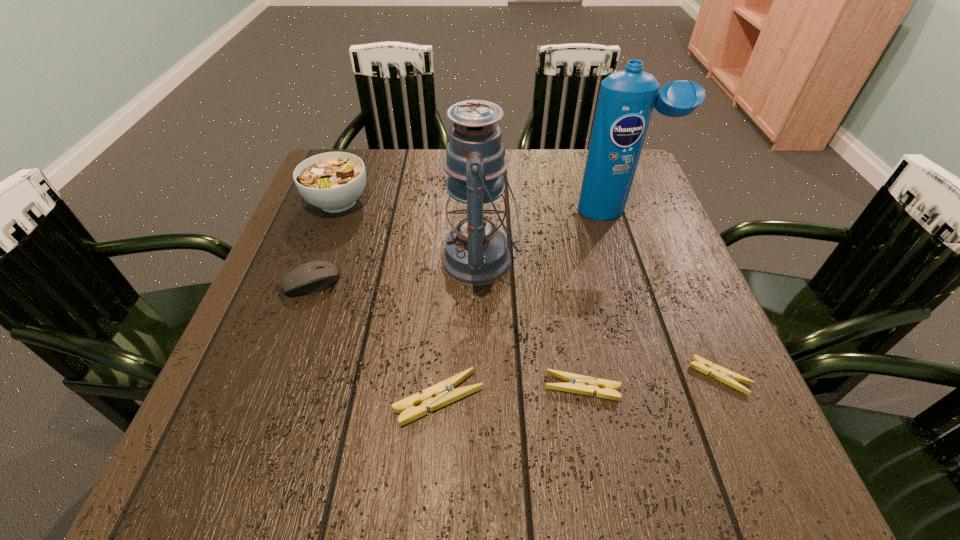
Where is `vacant area at the near right corner of the desktop`? This screenshot has width=960, height=540. vacant area at the near right corner of the desktop is located at coordinates (708, 419).

What are the coordinates of `empty space between the leftmost clothespin and the second shortest object` in the screenshot? It's located at (511, 393).

Locate an element on the screen. The width and height of the screenshot is (960, 540). vacant area that lies between the fourth tallest object and the shortest clothespin is located at coordinates (516, 329).

Find the location of a particular element. free spot between the lantern and the shampoo is located at coordinates (549, 237).

The height and width of the screenshot is (540, 960). What are the coordinates of `empty space between the second shortest object and the computer equipment` in the screenshot? It's located at (446, 335).

Where is `vacant space that is in between the second shortest object and the rightmost clothespin`? Image resolution: width=960 pixels, height=540 pixels. vacant space that is in between the second shortest object and the rightmost clothespin is located at coordinates (651, 382).

This screenshot has height=540, width=960. I want to click on vacant space that is in between the fourth shortest object and the leftmost clothespin, so click(375, 341).

I want to click on free space between the lantern and the fourth tallest object, so click(396, 272).

Identify which object is the second nearest to the lantern. Please provide its 2D coordinates. Your answer should be formatted as a tuple, i.e. [(x, y)], where the tuple contains the x and y coordinates of a point satisfying the conditions above.

[(443, 393)]

Select which object is the fourth closest to the lantern. Please provide its 2D coordinates. Your answer should be formatted as a tuple, i.e. [(x, y)], where the tuple contains the x and y coordinates of a point satisfying the conditions above.

[(333, 181)]